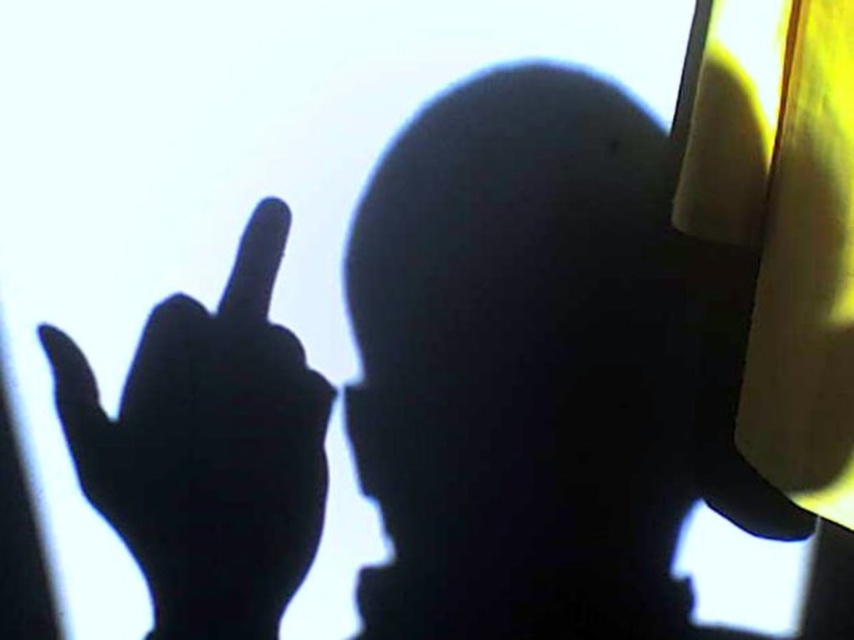
Between smooth yellow helmet at center and black matte hand at upper left, which one has more height?

Standing taller between the two is smooth yellow helmet at center.

Who is higher up, smooth yellow helmet at center or black matte hand at upper left?

smooth yellow helmet at center is above.

Where is `smooth yellow helmet at center`? smooth yellow helmet at center is located at coordinates (539, 371).

Locate an element on the screen. The height and width of the screenshot is (640, 854). smooth yellow helmet at center is located at coordinates (539, 371).